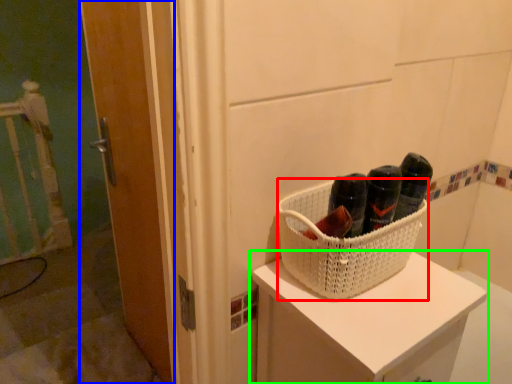
Question: Estimate the real-world distances between objects in this image. Which object is farther from basket (highlighted by a red box), door (highlighted by a blue box) or furniture (highlighted by a green box)?

Choices:
 (A) door
 (B) furniture

Answer: (A)